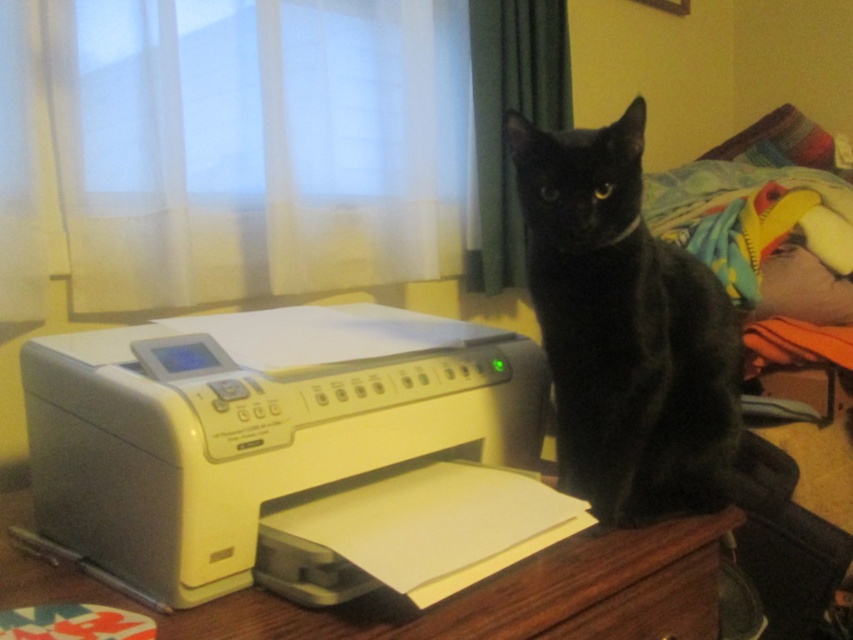
Question: Among these objects, which one is nearest to the camera?

Choices:
 (A) wooden drawer at lower center
 (B) wooden table at center

Answer: (B)

Question: Does wooden table at center have a larger size compared to wooden drawer at lower center?

Choices:
 (A) yes
 (B) no

Answer: (A)

Question: Considering the real-world distances, which object is farthest from the wooden table at center?

Choices:
 (A) wooden drawer at lower center
 (B) white plastic printer at lower left

Answer: (B)

Question: Does black glossy cat at center appear on the left side of wooden table at center?

Choices:
 (A) no
 (B) yes

Answer: (A)

Question: Estimate the real-world distances between objects in this image. Which object is closer to the black glossy cat at center?

Choices:
 (A) wooden table at center
 (B) white plastic printer at lower left
 (C) wooden drawer at lower center

Answer: (C)

Question: Is white plastic printer at lower left further to camera compared to wooden table at center?

Choices:
 (A) yes
 (B) no

Answer: (B)